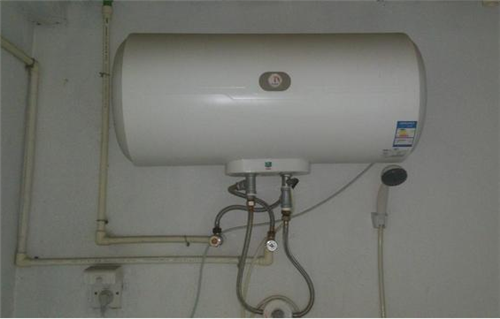
This screenshot has height=319, width=500. Identify the location of wall. (422, 191).